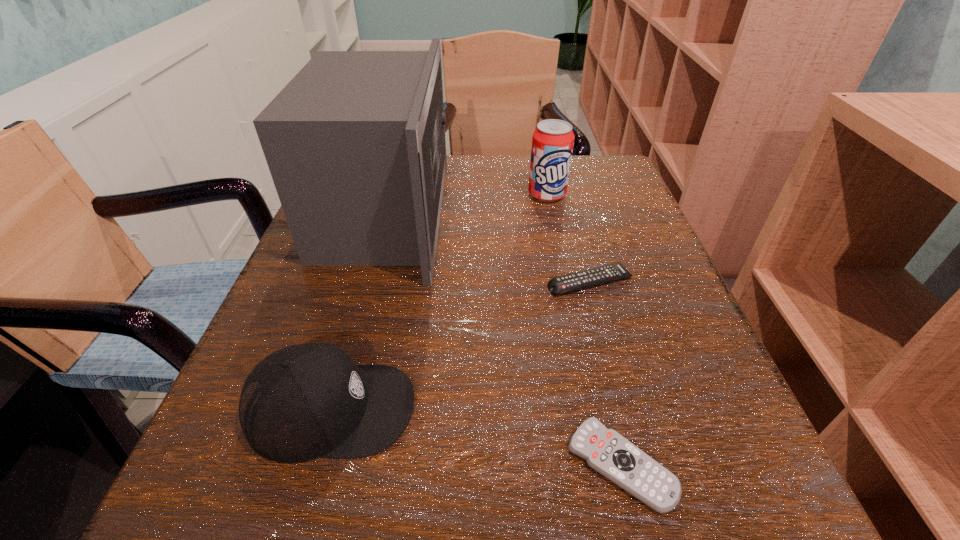
Locate an element on the screen. Image resolution: width=960 pixels, height=540 pixels. free region that satisfies the following two spatial constraints: 1. on the back side of the shorter remote control; 2. on the front-facing side of the cap is located at coordinates (608, 409).

Identify the location of vacant region that satisfies the following two spatial constraints: 1. on the surface of the fourth shortest object; 2. on the right side of the farther remote control. The image size is (960, 540). (565, 282).

Identify the location of free space that satisfies the following two spatial constraints: 1. on the surface of the soda can; 2. on the front-facing side of the tallest object. (551, 213).

Identify the location of vacant space that satisfies the following two spatial constraints: 1. on the surface of the soda can; 2. on the front-facing side of the tallest object. The image size is (960, 540). (551, 213).

Where is `vacant region that satisfies the following two spatial constraints: 1. on the surface of the fourth shortest object; 2. on the left side of the farther remote control`? The width and height of the screenshot is (960, 540). vacant region that satisfies the following two spatial constraints: 1. on the surface of the fourth shortest object; 2. on the left side of the farther remote control is located at coordinates (565, 282).

The width and height of the screenshot is (960, 540). I want to click on vacant region that satisfies the following two spatial constraints: 1. on the surface of the soda can; 2. on the front-facing side of the cap, so (x=592, y=409).

Locate an element on the screen. This screenshot has height=540, width=960. vacant space that satisfies the following two spatial constraints: 1. on the surface of the farther remote control; 2. on the left side of the second tallest object is located at coordinates click(565, 282).